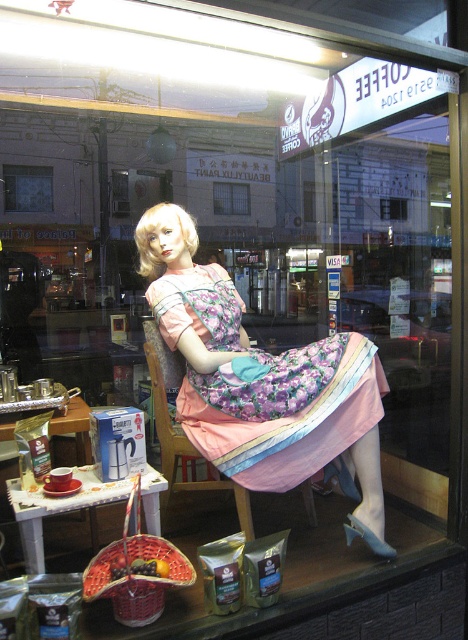
What are the coordinates of the floral fabric dress at center in the image?

The floral fabric dress at center is located at point (262, 380).

You are a customer entering the coffee shop and see the floral fabric dress at center and the clear glass window at center. Which object is closer to the entrance?

The floral fabric dress at center is closer to the entrance because it is positioned under the clear glass window at center, indicating it is in front of the window.